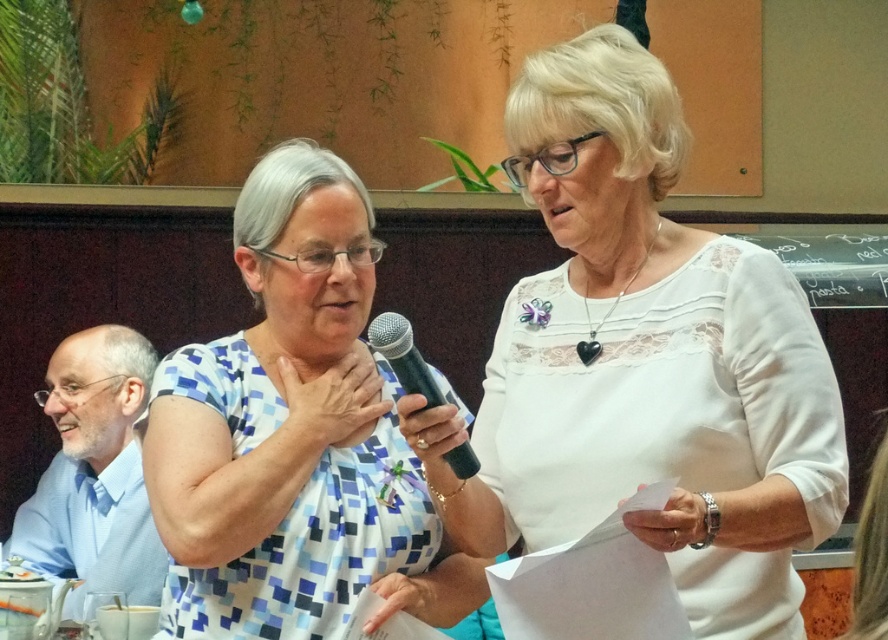
Question: Is blue shirt at left in front of black plastic microphone at center?

Choices:
 (A) no
 (B) yes

Answer: (A)

Question: Among these objects, which one is nearest to the camera?

Choices:
 (A) blue checkered dress at center
 (B) blue shirt at left
 (C) black plastic microphone at center
 (D) white lace blouse at upper center

Answer: (D)

Question: Can you confirm if blue shirt at left is bigger than black plastic microphone at center?

Choices:
 (A) no
 (B) yes

Answer: (B)

Question: Does white lace blouse at upper center appear on the right side of blue shirt at left?

Choices:
 (A) yes
 (B) no

Answer: (A)

Question: Which is farther from the blue shirt at left?

Choices:
 (A) black plastic microphone at center
 (B) white lace blouse at upper center

Answer: (B)

Question: Which object is the farthest from the blue shirt at left?

Choices:
 (A) blue checkered dress at center
 (B) black plastic microphone at center
 (C) white lace blouse at upper center

Answer: (C)